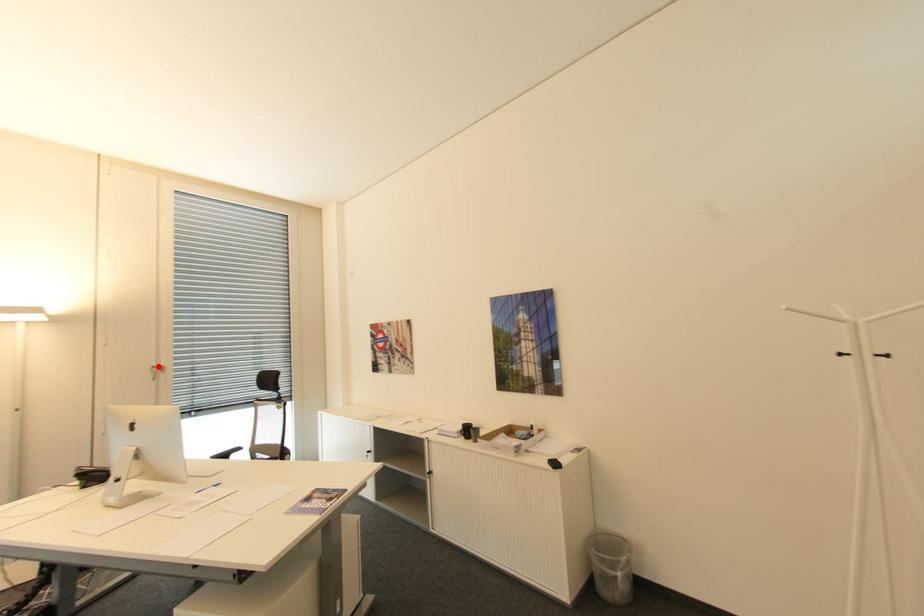
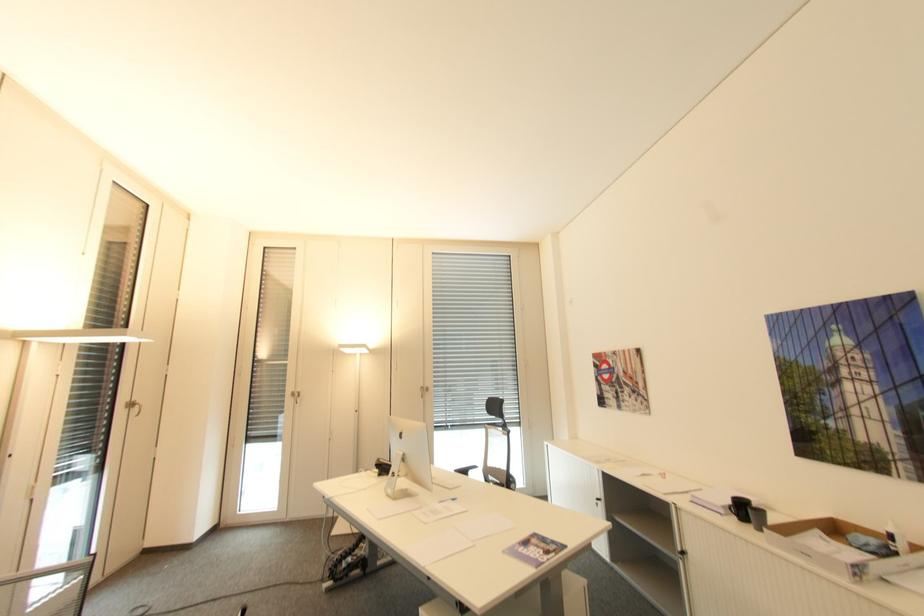
The point at the highlighted location is marked in the first image. Where is the corresponding point in the second image?

(427, 387)